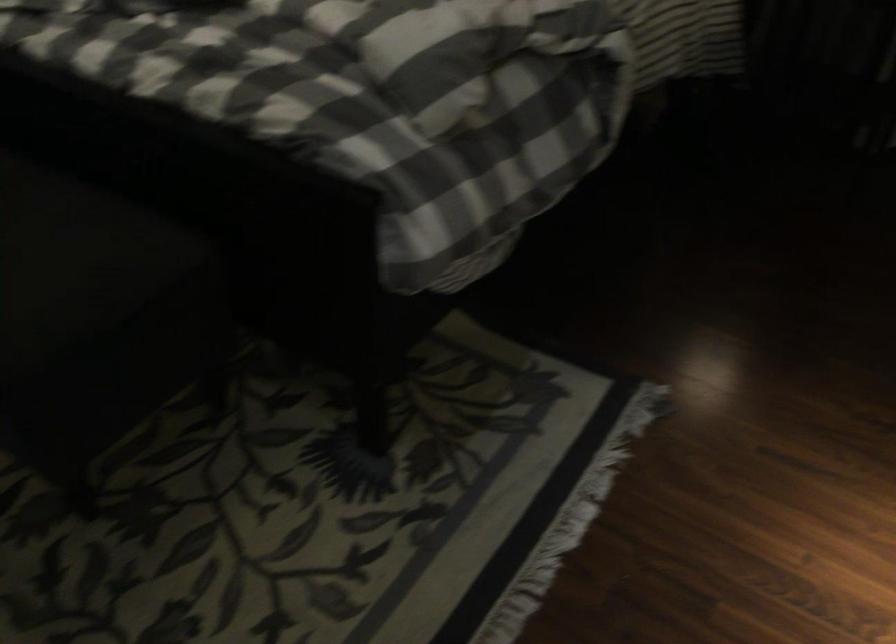
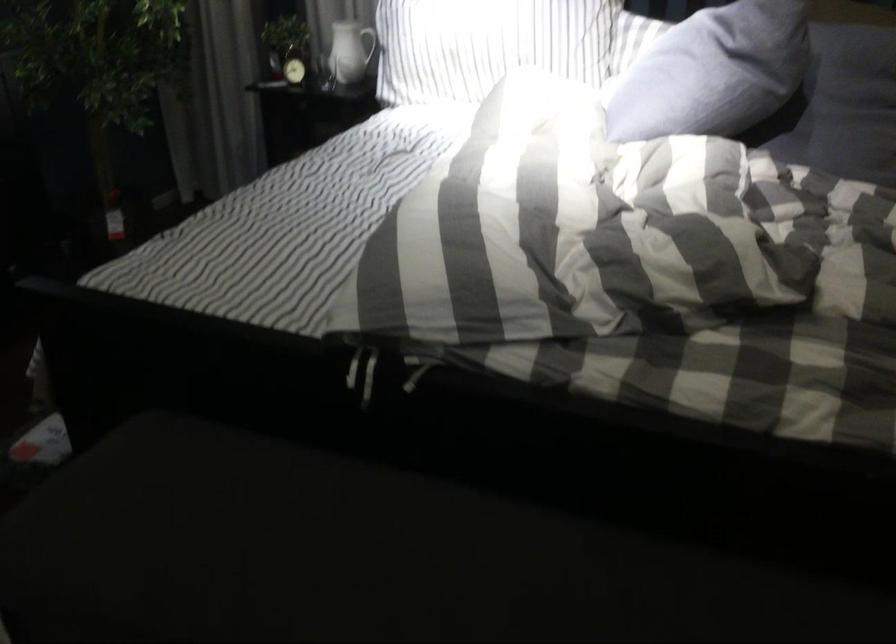
Question: Which direction would the cameraman need to move to produce the second image? Reply with the corresponding letter.

Choices:
 (A) Left
 (B) Right
 (C) Forward
 (D) Backward

Answer: (A)